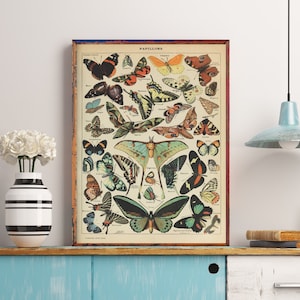
In order to click on white floors in this screenshot , I will do `click(20, 139)`.